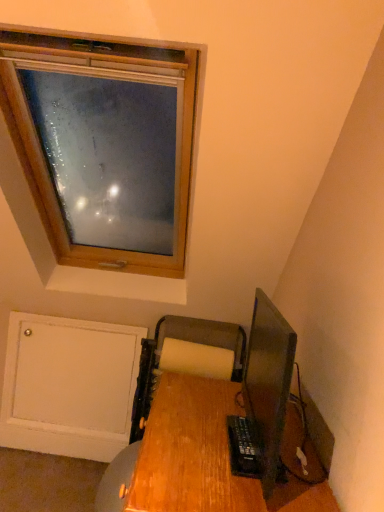
Image resolution: width=384 pixels, height=512 pixels. I want to click on matte black monitor at lower right, so click(268, 384).

The width and height of the screenshot is (384, 512). I want to click on printer behind the matte black monitor at lower right, so click(x=184, y=340).

Considering the positions of objects matte black monitor at lower right and wooden printer at lower center in the image provided, who is more to the right, matte black monitor at lower right or wooden printer at lower center?

From the viewer's perspective, matte black monitor at lower right appears more on the right side.

Is matte black monitor at lower right outside of wooden printer at lower center?

Absolutely, matte black monitor at lower right is external to wooden printer at lower center.

What's the angular difference between matte black monitor at lower right and wooden printer at lower center's facing directions?

The angular difference between matte black monitor at lower right and wooden printer at lower center is 88 degrees.

Which of these two, wooden printer at lower center or wooden desk at lower right, is bigger?

Bigger between the two is wooden desk at lower right.

Is wooden printer at lower center facing away from wooden desk at lower right?

wooden printer at lower center is not turned away from wooden desk at lower right.

Can you confirm if wooden printer at lower center is shorter than wooden desk at lower right?

No.

Is wooden desk at lower right positioned in front of matte black monitor at lower right?

Yes, the depth of wooden desk at lower right is less than that of matte black monitor at lower right.

Considering the sizes of objects wooden desk at lower right and matte black monitor at lower right in the image provided, who is smaller, wooden desk at lower right or matte black monitor at lower right?

matte black monitor at lower right.

Is wooden desk at lower right oriented away from matte black monitor at lower right?

No, matte black monitor at lower right is not at the back of wooden desk at lower right.

Is wooden desk at lower right far away from matte black monitor at lower right?

Yes, wooden desk at lower right and matte black monitor at lower right are quite far apart.

Does point (142, 403) lie behind point (255, 343)?

No, it is in front of (255, 343).

Between wooden printer at lower center and matte black monitor at lower right, which one is positioned behind?

wooden printer at lower center is behind.

Is wooden printer at lower center touching matte black monitor at lower right?

wooden printer at lower center and matte black monitor at lower right are clearly separated.

Which of these two, wooden printer at lower center or matte black monitor at lower right, is bigger?

wooden printer at lower center is bigger.

Which is more to the right, wooden desk at lower right or wooden printer at lower center?

wooden desk at lower right is more to the right.

Is wooden printer at lower center at the back of wooden desk at lower right?

No, wooden desk at lower right is not facing the opposite direction of wooden printer at lower center.

Does wooden desk at lower right have a lesser height compared to wooden printer at lower center?

Yes, wooden desk at lower right is shorter than wooden printer at lower center.

Where is `printer on the left side of wooden desk at lower right`? The width and height of the screenshot is (384, 512). printer on the left side of wooden desk at lower right is located at coordinates tap(184, 340).

From the image's perspective, is matte black monitor at lower right on top of wooden desk at lower right?

Yes, from the image's perspective, matte black monitor at lower right is on top of wooden desk at lower right.

Is matte black monitor at lower right at the left side of wooden desk at lower right?

No.

Which of these two, matte black monitor at lower right or wooden desk at lower right, is bigger?

wooden desk at lower right is bigger.

Where is `television located above the wooden printer at lower center (from the image's perspective)`? The height and width of the screenshot is (512, 384). television located above the wooden printer at lower center (from the image's perspective) is located at coordinates (268, 384).

The height and width of the screenshot is (512, 384). Find the location of `desk in front of the wooden printer at lower center`. desk in front of the wooden printer at lower center is located at coordinates (208, 458).

Looking at the image, which one is located closer to wooden desk at lower right, matte black monitor at lower right or wooden printer at lower center?

wooden printer at lower center is closer to wooden desk at lower right.

Based on their spatial positions, is wooden printer at lower center or wooden desk at lower right closer to matte black monitor at lower right?

wooden printer at lower center is closer to matte black monitor at lower right.

Based on their spatial positions, is wooden desk at lower right or matte black monitor at lower right closer to wooden printer at lower center?

matte black monitor at lower right lies closer to wooden printer at lower center than the other object.

Considering their positions, is wooden printer at lower center positioned closer to wooden desk at lower right than matte black monitor at lower right?

Among the two, wooden printer at lower center is located nearer to wooden desk at lower right.

Estimate the real-world distances between objects in this image. Which object is closer to matte black monitor at lower right, wooden desk at lower right or wooden printer at lower center?

Based on the image, wooden printer at lower center appears to be nearer to matte black monitor at lower right.

Estimate the real-world distances between objects in this image. Which object is further from wooden printer at lower center, matte black monitor at lower right or wooden desk at lower right?

wooden desk at lower right is further to wooden printer at lower center.

This screenshot has width=384, height=512. Identify the location of television between wooden desk at lower right and wooden printer at lower center from front to back. (268, 384).